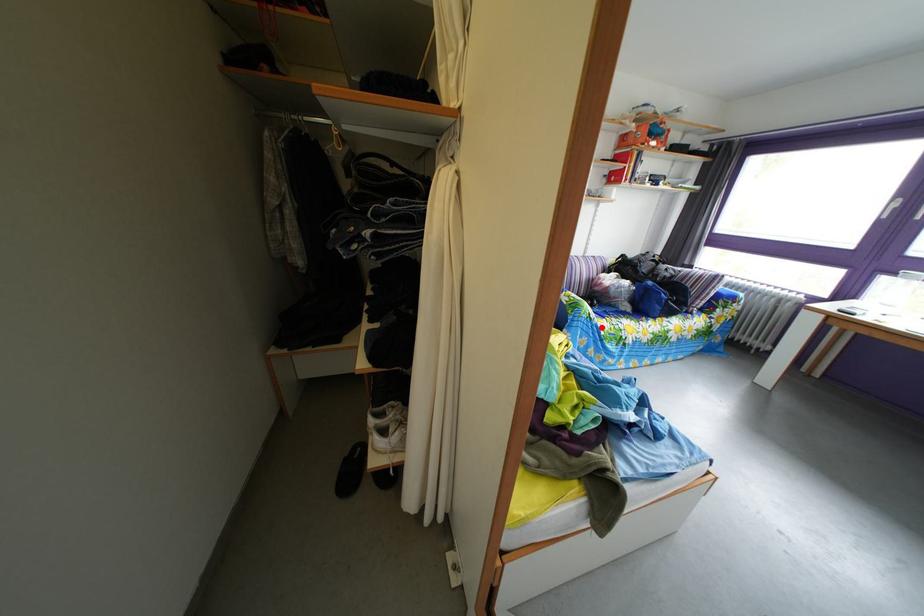
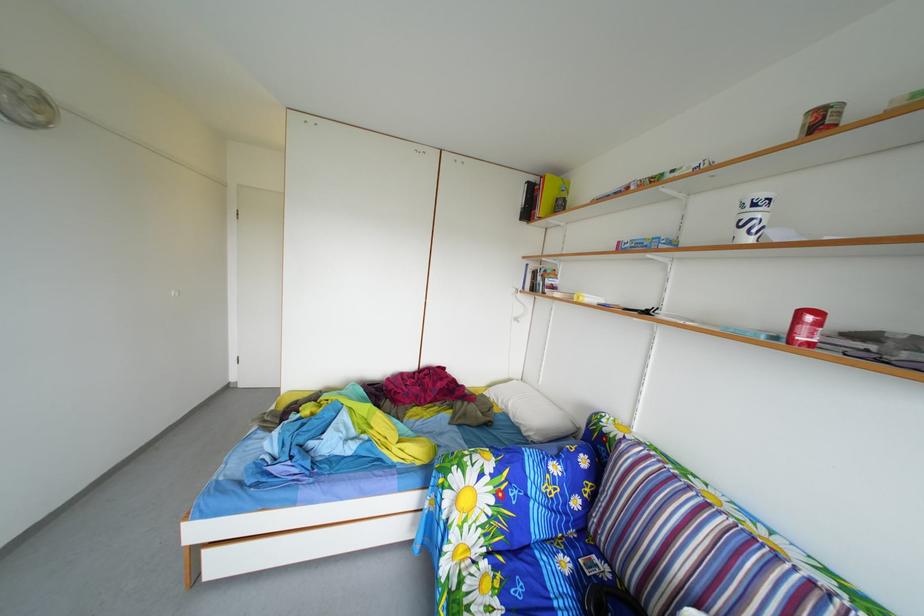
In the second image, find the point that corresponds to the highlighted location in the first image.

(453, 507)